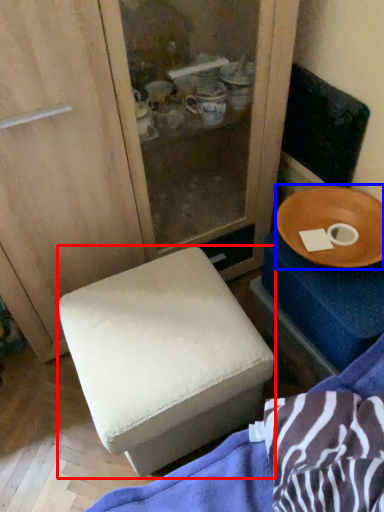
Question: Which object appears closest to the camera in this image, furniture (highlighted by a red box) or tableware (highlighted by a blue box)?

Choices:
 (A) furniture
 (B) tableware

Answer: (A)